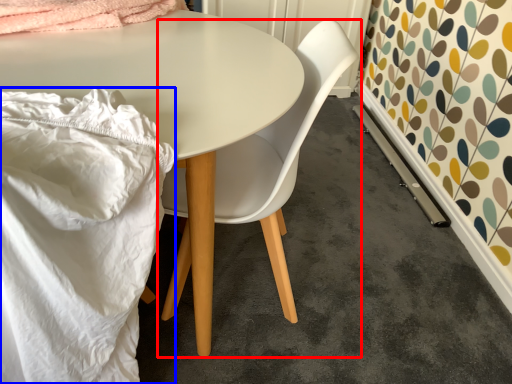
Question: Among these objects, which one is farthest to the camera, chair (highlighted by a red box) or blanket (highlighted by a blue box)?

Choices:
 (A) chair
 (B) blanket

Answer: (A)